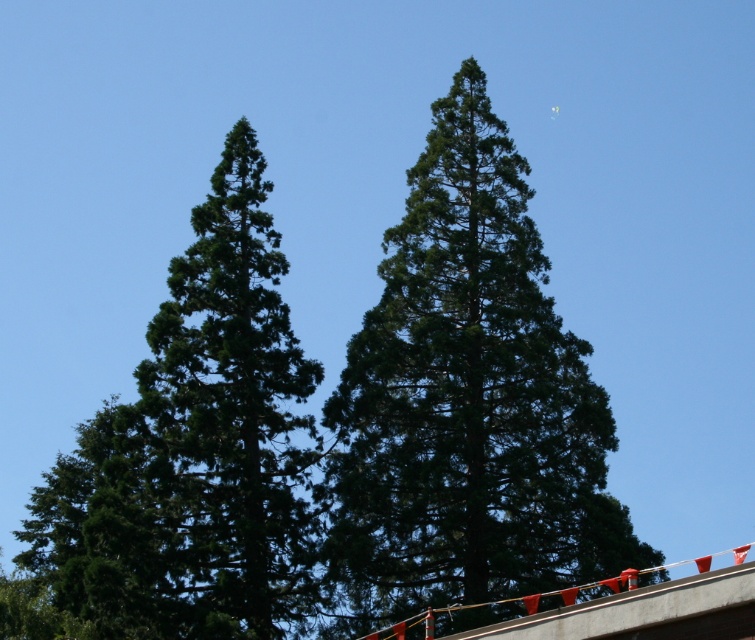
Question: Which point is farther from the camera taking this photo?

Choices:
 (A) (472, 193)
 (B) (162, 330)

Answer: (A)

Question: Does green textured tree at center have a lesser width compared to green needle-like at left?

Choices:
 (A) yes
 (B) no

Answer: (A)

Question: Can you confirm if green textured tree at center is thinner than green needle-like at left?

Choices:
 (A) no
 (B) yes

Answer: (B)

Question: Among these points, which one is nearest to the camera?

Choices:
 (A) (476, 257)
 (B) (171, 371)

Answer: (B)

Question: Considering the relative positions of green textured tree at center and green needle-like at left in the image provided, where is green textured tree at center located with respect to green needle-like at left?

Choices:
 (A) left
 (B) right

Answer: (B)